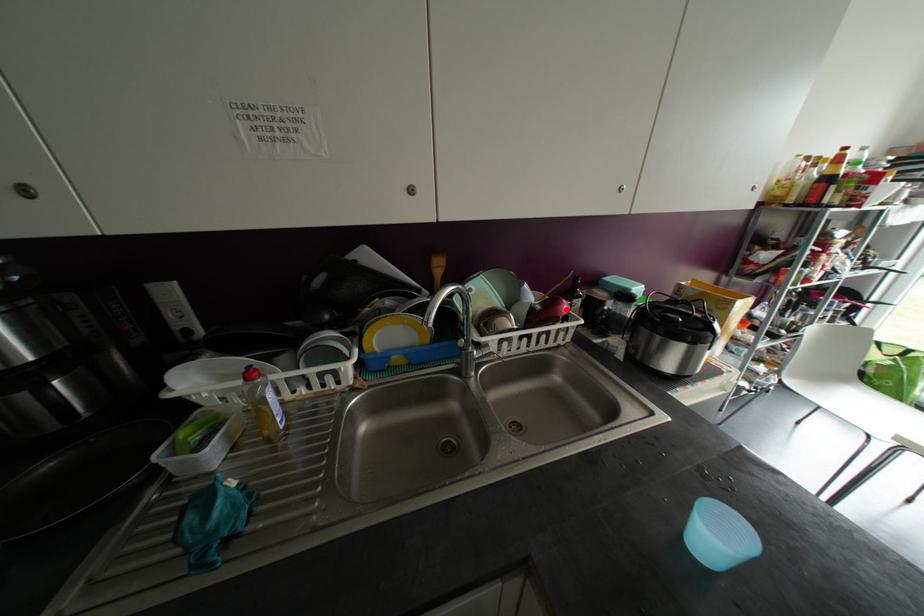
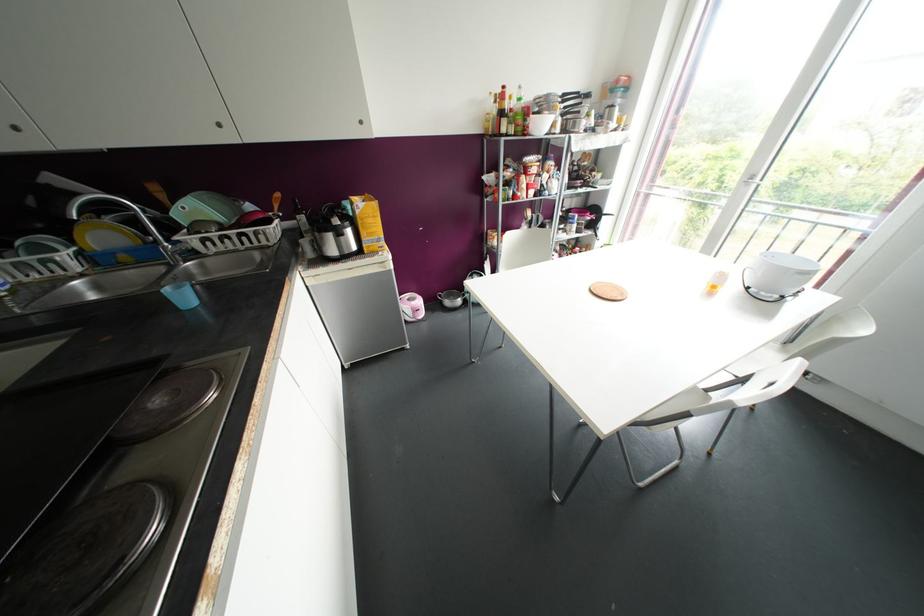
Where in the second image is the point corresponding to the highlighted location from the first image?

(257, 217)